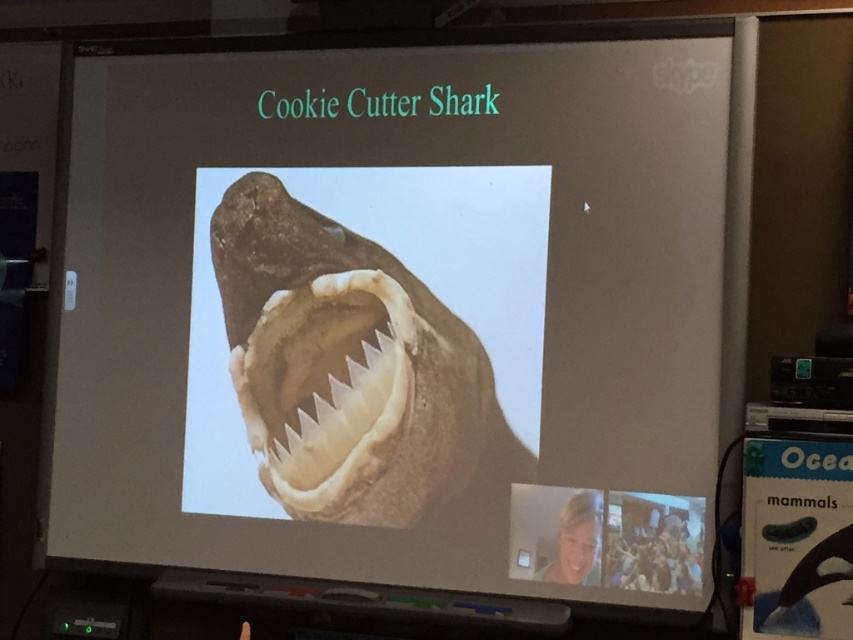
From the picture: You are an art student analyzing the projected slide during a Skype call. You notice the brown rough cookie cutter shark at center and the white glossy teeth at center. Which object on the slide appears bigger?

The brown rough cookie cutter shark at center has a larger size compared to the white glossy teeth at center, so the brown rough cookie cutter shark at center appears bigger.

You are a student attending a virtual marine biology class via Skype. You see the brown rough cookie cutter shark at center and the white glossy teeth at center on the slide. Which object is positioned higher on the slide?

The brown rough cookie cutter shark at center is taller than white glossy teeth at center, so the brown rough cookie cutter shark at center is positioned higher on the slide.